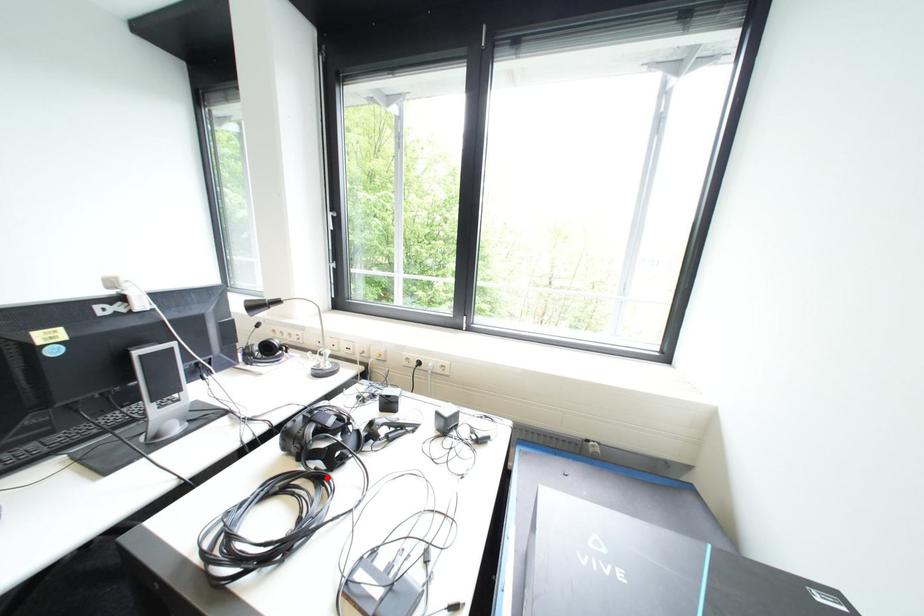
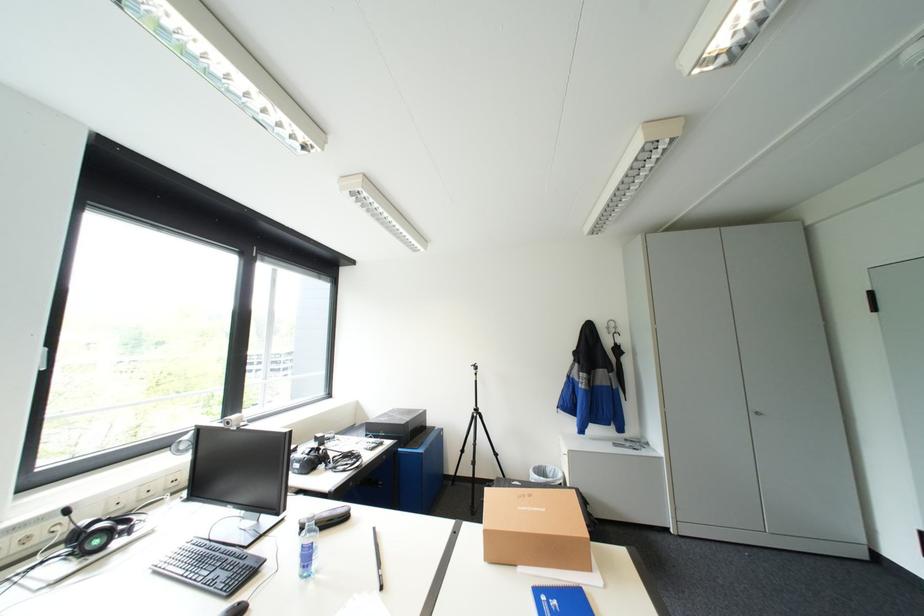
Question: I am providing you with two images of the same scene from different viewpoints. A red point is marked on the first image. At the location where the point appears in image 1, is it still visible in image 2?

Choices:
 (A) Yes
 (B) No

Answer: (B)